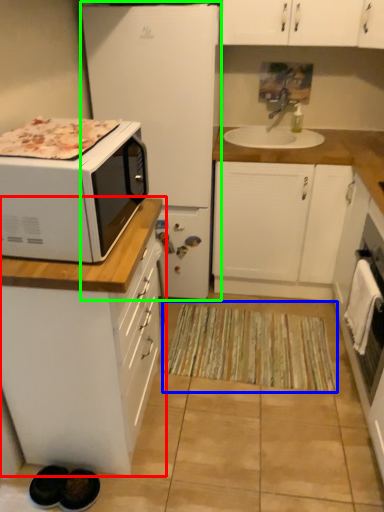
Question: Which object is the closest to the cabinetry (highlighted by a red box)? Choose among these: doormat (highlighted by a blue box) or refrigerator (highlighted by a green box).

Choices:
 (A) doormat
 (B) refrigerator

Answer: (A)